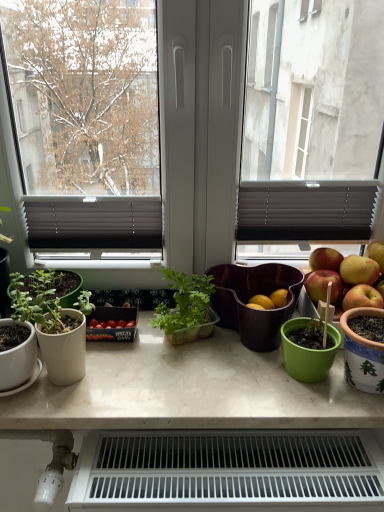
Image resolution: width=384 pixels, height=512 pixels. Identify the location of free spot in front of translucent plastic plant container at center, which is the 2th houseplant in left-to-right order. (192, 387).